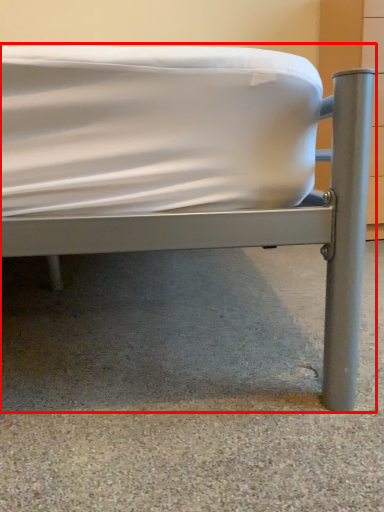
Question: From the image's perspective, what is the correct spatial relationship of bed (annotated by the red box) in relation to concrete?

Choices:
 (A) above
 (B) below

Answer: (A)